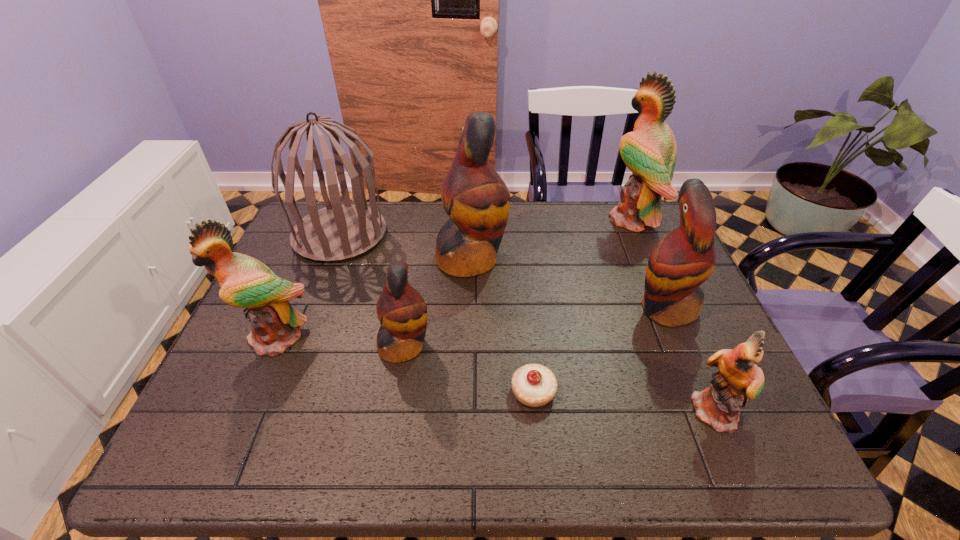
Locate an element on the screen. The height and width of the screenshot is (540, 960). vacant point located on the face of the second biggest red parrot is located at coordinates (602, 308).

Find the location of `vacant area situated on the face of the second biggest red parrot`. vacant area situated on the face of the second biggest red parrot is located at coordinates (498, 308).

Find the location of a particular element. The height and width of the screenshot is (540, 960). vacant space located on the front-facing side of the leftmost green parrot is located at coordinates (252, 395).

This screenshot has height=540, width=960. Find the location of `vacant space situated on the face of the nearest red parrot`. vacant space situated on the face of the nearest red parrot is located at coordinates (547, 346).

At what (x,y) coordinates should I click in order to perform the action: click on vacant area located 0.120m on the back of the pastry. Please return your answer as a coordinate pair (x, y). The image size is (960, 540). Looking at the image, I should click on (527, 333).

At what (x,y) coordinates should I click in order to perform the action: click on birdcage present at the far edge. Please return your answer as a coordinate pair (x, y). The image size is (960, 540). Looking at the image, I should click on (338, 232).

Locate an element on the screen. The width and height of the screenshot is (960, 540). object at the near edge is located at coordinates (739, 378).

You are a GUI agent. You are given a task and a screenshot of the screen. Output one action in this format:
    pyautogui.click(x=<x>, y=<y>)
    Task: Click on the birdcage that is positioned at the left edge
    The height and width of the screenshot is (540, 960).
    Given the screenshot: What is the action you would take?
    pyautogui.click(x=338, y=232)

Where is `parrot at the left edge`? parrot at the left edge is located at coordinates (245, 282).

Where is `object that is at the far left corner`? object that is at the far left corner is located at coordinates (338, 232).